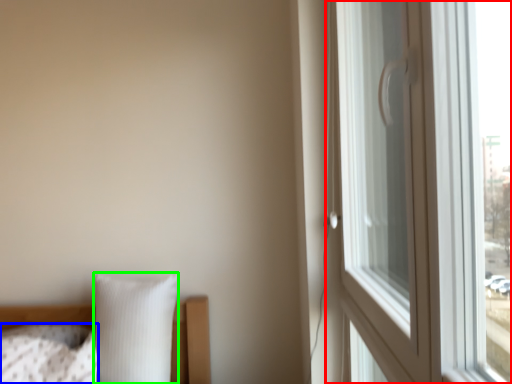
Question: Which object is positioned farthest from window (highlighted by a red box)? Select from pillow (highlighted by a blue box) and pillow (highlighted by a green box).

Choices:
 (A) pillow
 (B) pillow

Answer: (A)